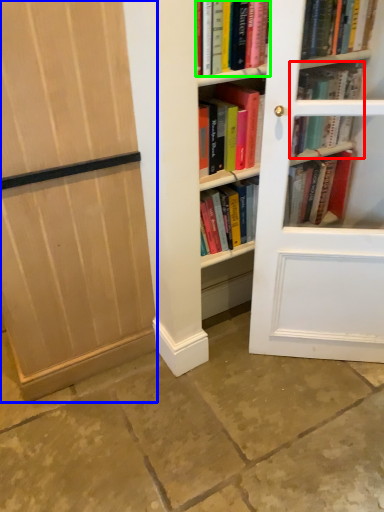
Question: Based on their relative distances, which object is nearer to book (highlighted by a red box)? Choose from door (highlighted by a blue box) and book (highlighted by a green box).

Choices:
 (A) door
 (B) book

Answer: (B)